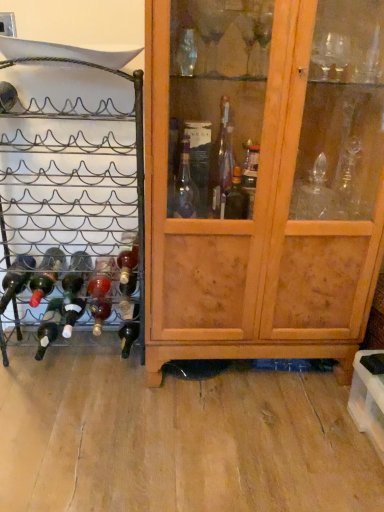
Question: Considering the relative sizes of translucent glass bottle at center and matte glass bottle at lower left, positioned as the third bottle in right-to-left order, in the image provided, is translucent glass bottle at center bigger than matte glass bottle at lower left, positioned as the third bottle in right-to-left order,?

Choices:
 (A) no
 (B) yes

Answer: (B)

Question: Is translucent glass bottle at center oriented towards matte glass bottle at lower left, the 5th bottle when ordered from left to right?

Choices:
 (A) no
 (B) yes

Answer: (A)

Question: Is translucent glass bottle at center closer to camera compared to matte glass bottle at lower left, positioned as the third bottle in right-to-left order?

Choices:
 (A) no
 (B) yes

Answer: (A)

Question: From the image's perspective, is translucent glass bottle at center under matte glass bottle at lower left, positioned as the third bottle in right-to-left order?

Choices:
 (A) no
 (B) yes

Answer: (B)

Question: From a real-world perspective, is translucent glass bottle at center located higher than matte glass bottle at lower left, the 5th bottle when ordered from left to right?

Choices:
 (A) no
 (B) yes

Answer: (A)

Question: Considering their positions, is translucent glass bottle at center located in front of or behind matte glass bottle at lower left, positioned as the third bottle in right-to-left order?

Choices:
 (A) front
 (B) behind

Answer: (B)

Question: From the image's perspective, is translucent glass bottle at center above or below matte glass bottle at lower left, positioned as the third bottle in right-to-left order?

Choices:
 (A) below
 (B) above

Answer: (A)

Question: Would you say translucent glass bottle at center is inside or outside matte glass bottle at lower left, the 5th bottle when ordered from left to right?

Choices:
 (A) outside
 (B) inside

Answer: (A)

Question: Considering the positions of translucent glass bottle at center and matte glass bottle at lower left, the 5th bottle when ordered from left to right, in the image, is translucent glass bottle at center wider or thinner than matte glass bottle at lower left, the 5th bottle when ordered from left to right,?

Choices:
 (A) wide
 (B) thin

Answer: (A)

Question: Would you say black metal wine rack at left is inside or outside dark glass bottle at lower left, which is the sixth bottle in left-to-right order?

Choices:
 (A) outside
 (B) inside

Answer: (A)

Question: Based on their positions, is black metal wine rack at left located to the left or right of dark glass bottle at lower left, the second bottle in the right-to-left sequence?

Choices:
 (A) left
 (B) right

Answer: (A)

Question: Relative to dark glass bottle at lower left, which is the sixth bottle in left-to-right order, is black metal wine rack at left in front or behind?

Choices:
 (A) front
 (B) behind

Answer: (A)

Question: In terms of size, does black metal wine rack at left appear bigger or smaller than dark glass bottle at lower left, which is the sixth bottle in left-to-right order?

Choices:
 (A) big
 (B) small

Answer: (A)

Question: In the image, is green matte bottle at lower left, the fourth bottle viewed from the left, on the left side or the right side of matte black wine bottle at left, which is counted as the first bottle, starting from the left?

Choices:
 (A) left
 (B) right

Answer: (B)

Question: From the image's perspective, is green matte bottle at lower left, the fourth bottle viewed from the left, located above or below matte black wine bottle at left, which is counted as the first bottle, starting from the left?

Choices:
 (A) above
 (B) below

Answer: (B)